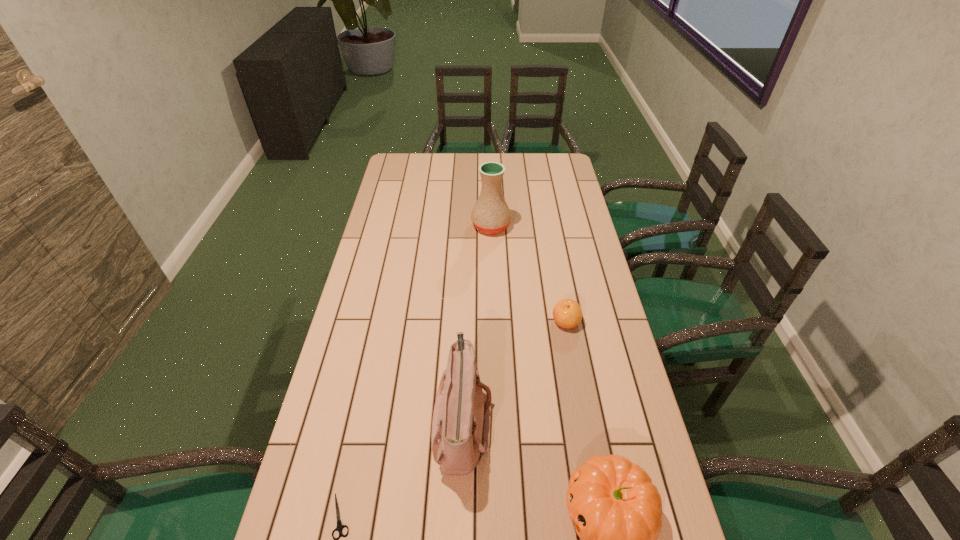
The width and height of the screenshot is (960, 540). I want to click on the tallest object, so click(491, 214).

The image size is (960, 540). Identify the location of pottery. (491, 214).

Identify the location of shoulder bag. The width and height of the screenshot is (960, 540). (461, 421).

Identify the location of the fourth tallest object. The image size is (960, 540). [567, 313].

The height and width of the screenshot is (540, 960). I want to click on clementine, so click(x=567, y=313).

In order to click on free space located 0.060m on the left of the pottery in this screenshot , I will do `click(456, 226)`.

Identify the location of vacant region located on the front pocket of the fourth shortest object. This screenshot has height=540, width=960. click(628, 421).

The height and width of the screenshot is (540, 960). Find the location of `free space located 0.170m on the front of the clementine`. free space located 0.170m on the front of the clementine is located at coordinates (576, 380).

Identify the location of object positioned at the right edge. (567, 313).

Where is `vacant space at the far edge of the desktop`? The height and width of the screenshot is (540, 960). vacant space at the far edge of the desktop is located at coordinates (483, 153).